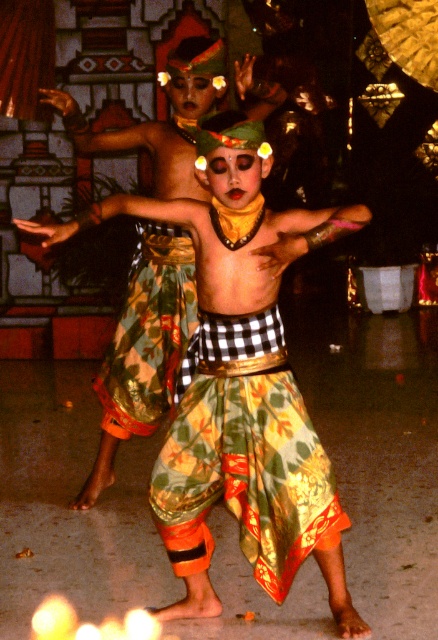
Does printed silk skirt at center appear on the right side of printed fabric dancer at center?

Indeed, printed silk skirt at center is positioned on the right side of printed fabric dancer at center.

Who is shorter, printed silk skirt at center or printed fabric dancer at center?

With less height is printed fabric dancer at center.

Between point (296, 392) and point (182, 180), which one is positioned in front?

Point (296, 392) is in front.

I want to click on printed silk skirt at center, so click(x=243, y=454).